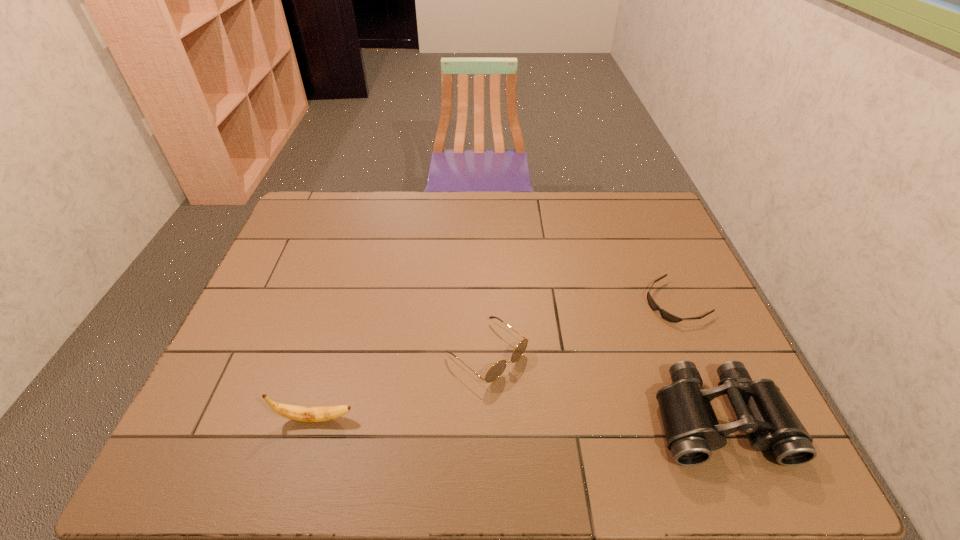
Where is `free spot on the desktop that is between the banana and the binoculars and is positioned on the lenses of the third object from right to left`? This screenshot has width=960, height=540. free spot on the desktop that is between the banana and the binoculars and is positioned on the lenses of the third object from right to left is located at coordinates (569, 418).

Identify the location of vacant space on the desktop that is between the leftmost object and the binoculars and is positioned on the front-facing side of the right sunglasses. (471, 418).